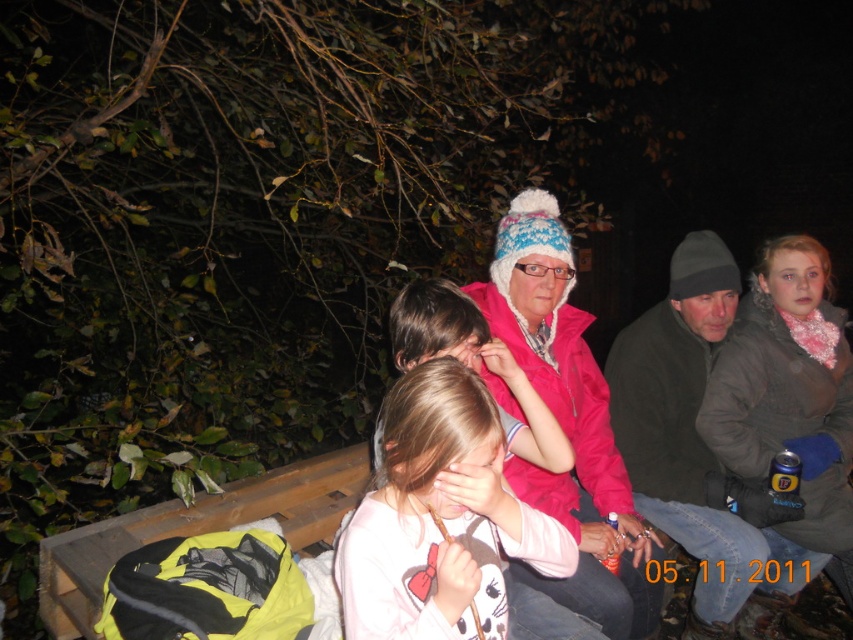
You are standing in the woods at night and see two people wearing jackets. The first is wearing a pink fleece jacket at center, and the second has a brown fuzzy jacket at upper right. Which jacket is nearer to you?

The pink fleece jacket at center is closer to the viewer than the brown fuzzy jacket at upper right, so the pink fleece jacket at center is nearer.